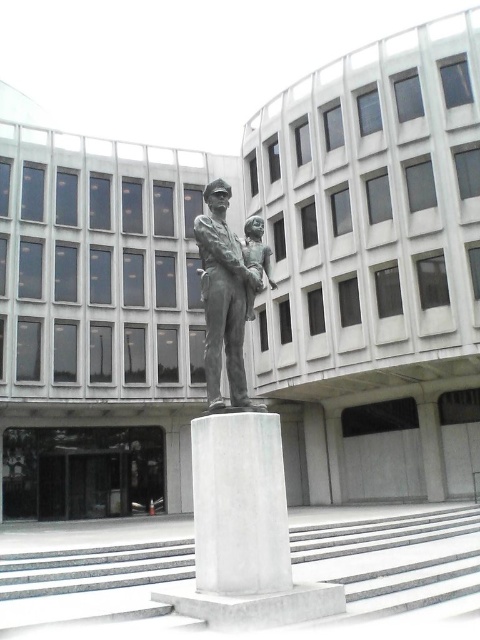
Question: Where is white marble pillar at center located in relation to bronze statue at center in the image?

Choices:
 (A) right
 (B) left

Answer: (A)

Question: Can you confirm if white marble pillar at center is positioned to the left of bronze statue at center?

Choices:
 (A) no
 (B) yes

Answer: (A)

Question: Which object is farther from the camera taking this photo?

Choices:
 (A) bronze statue at center
 (B) white marble pillar at center

Answer: (A)

Question: Can you confirm if white marble pillar at center is positioned above bronze statue at center?

Choices:
 (A) yes
 (B) no

Answer: (B)

Question: Which object appears farthest from the camera in this image?

Choices:
 (A) bronze statue at center
 (B) white marble pillar at center

Answer: (A)